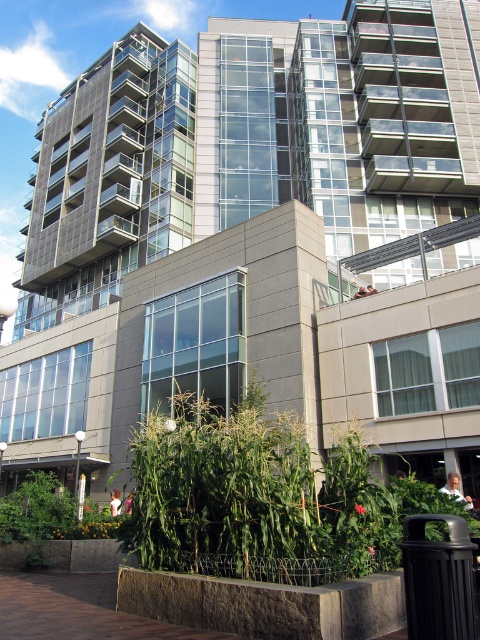
Question: Which of the following is the farthest from the observer?

Choices:
 (A) (51, 480)
 (B) (228, 444)

Answer: (A)

Question: Where is green leafy plant at lower center located in relation to green leafy plant at lower left in the image?

Choices:
 (A) above
 (B) below

Answer: (A)

Question: Does green leafy plant at lower center have a larger size compared to green leafy plant at lower left?

Choices:
 (A) yes
 (B) no

Answer: (B)

Question: Among these points, which one is nearest to the camera?

Choices:
 (A) (10, 518)
 (B) (359, 528)

Answer: (B)

Question: Among these points, which one is farthest from the camera?

Choices:
 (A) (60, 488)
 (B) (302, 538)

Answer: (A)

Question: Where is green leafy plant at lower center located in relation to green leafy plant at lower left in the image?

Choices:
 (A) above
 (B) below

Answer: (A)